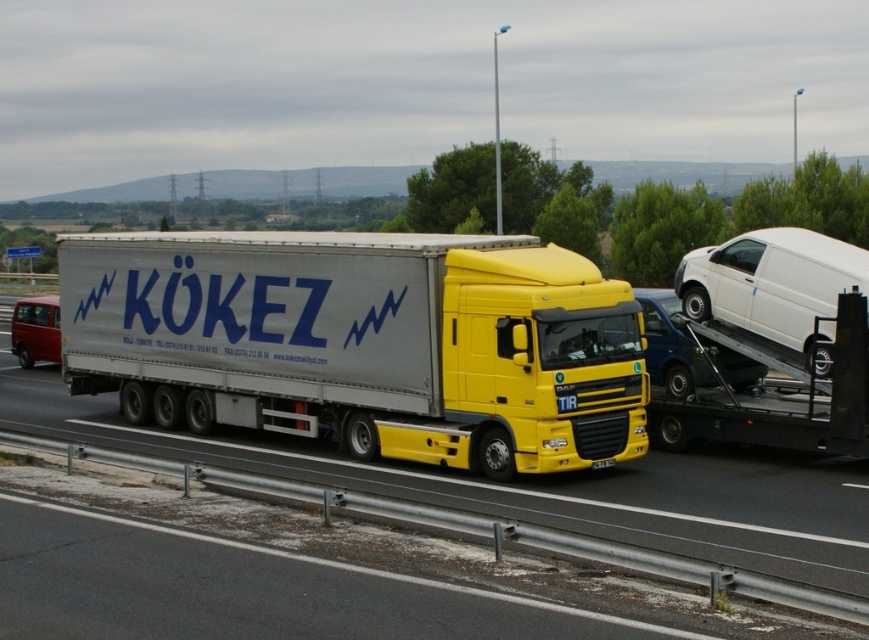
Does yellow metallic truck at center lie in front of white matte van at right?

That is True.

Can you confirm if yellow metallic truck at center is thinner than white matte van at right?

No, yellow metallic truck at center is not thinner than white matte van at right.

Who is more distant from viewer, (495, 515) or (807, 298)?

Point (807, 298)

You are a GUI agent. You are given a task and a screenshot of the screen. Output one action in this format:
    pyautogui.click(x=<x>, y=<y>)
    Task: Click on the yellow metallic truck at center
    This screenshot has height=640, width=869.
    Given the screenshot: What is the action you would take?
    pyautogui.click(x=304, y=552)

Does yellow metallic truck at center have a greater width compared to white glossy van at right?

Indeed, yellow metallic truck at center has a greater width compared to white glossy van at right.

Is point (121, 618) positioned after point (687, 378)?

That is False.

The height and width of the screenshot is (640, 869). What are the coordinates of `yellow metallic truck at center` in the screenshot? It's located at (304, 552).

Describe the element at coordinates (780, 394) in the screenshot. I see `metallic silver tow truck at right` at that location.

Based on the photo, is the position of metallic silver tow truck at right less distant than that of white matte van at right?

Yes, it is in front of white matte van at right.

At what (x,y) coordinates should I click in order to perform the action: click on metallic silver tow truck at right. Please return your answer as a coordinate pair (x, y). The width and height of the screenshot is (869, 640). Looking at the image, I should click on (780, 394).